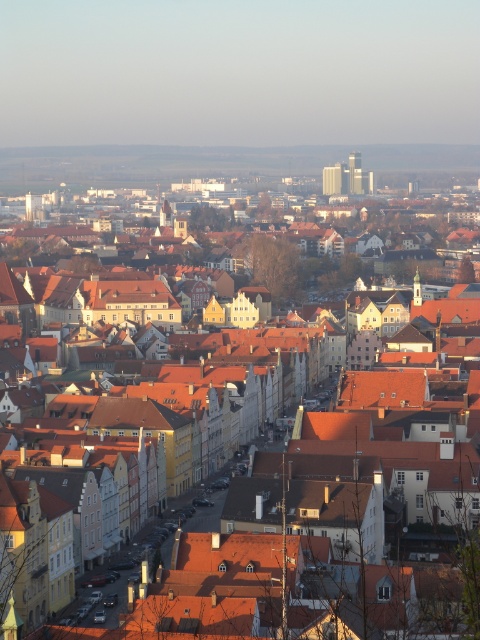
Question: Which object is farther from the camera taking this photo?

Choices:
 (A) gray concrete skyscraper at upper center
 (B) matte glass skyscraper at upper center

Answer: (A)

Question: Can you confirm if gray concrete skyscraper at upper center is thinner than matte glass skyscraper at upper center?

Choices:
 (A) no
 (B) yes

Answer: (B)

Question: Is matte orange rooftops at center to the right of gray concrete skyscraper at upper center from the viewer's perspective?

Choices:
 (A) yes
 (B) no

Answer: (B)

Question: Which object is positioned farthest from the matte glass skyscraper at upper center?

Choices:
 (A) matte orange rooftops at center
 (B) gray concrete skyscraper at upper center

Answer: (A)

Question: Among these objects, which one is nearest to the camera?

Choices:
 (A) matte orange rooftops at center
 (B) gray concrete skyscraper at upper center
 (C) matte glass skyscraper at upper center

Answer: (A)

Question: Does gray concrete skyscraper at upper center appear under matte glass skyscraper at upper center?

Choices:
 (A) yes
 (B) no

Answer: (B)